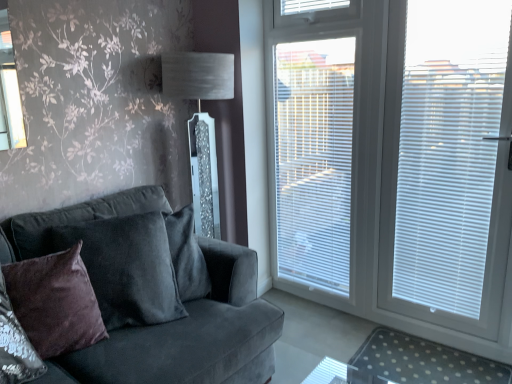
Question: Considering the relative sizes of white blinds at right and white plastic blinds at right, positioned as the third blind in left-to-right order, in the image provided, is white blinds at right bigger than white plastic blinds at right, positioned as the third blind in left-to-right order,?

Choices:
 (A) no
 (B) yes

Answer: (B)

Question: Does white blinds at right have a smaller size compared to white plastic blinds at right, positioned as the third blind in left-to-right order?

Choices:
 (A) yes
 (B) no

Answer: (B)

Question: From a real-world perspective, is white blinds at right physically above white plastic blinds at right, positioned as the third blind in left-to-right order?

Choices:
 (A) no
 (B) yes

Answer: (A)

Question: From the image's perspective, is white blinds at right over white plastic blinds at right, positioned as the third blind in left-to-right order?

Choices:
 (A) no
 (B) yes

Answer: (B)

Question: Can you confirm if white blinds at right is positioned to the left of white plastic blinds at right, positioned as the 1th blind in right-to-left order?

Choices:
 (A) yes
 (B) no

Answer: (A)

Question: From a real-world perspective, is white blinds at right beneath white plastic blinds at right, positioned as the third blind in left-to-right order?

Choices:
 (A) yes
 (B) no

Answer: (A)

Question: Is white blinds at right positioned in front of clear polka dot mat at lower right?

Choices:
 (A) no
 (B) yes

Answer: (B)

Question: Would you consider white blinds at right to be distant from clear polka dot mat at lower right?

Choices:
 (A) yes
 (B) no

Answer: (B)

Question: Does white blinds at right appear on the left side of clear polka dot mat at lower right?

Choices:
 (A) yes
 (B) no

Answer: (A)

Question: Is white blinds at right located outside clear polka dot mat at lower right?

Choices:
 (A) no
 (B) yes

Answer: (B)

Question: Considering the relative sizes of white blinds at right and clear polka dot mat at lower right in the image provided, is white blinds at right taller than clear polka dot mat at lower right?

Choices:
 (A) yes
 (B) no

Answer: (A)

Question: Is white blinds at right looking in the opposite direction of clear polka dot mat at lower right?

Choices:
 (A) no
 (B) yes

Answer: (A)

Question: Considering the relative sizes of clear polka dot mat at lower right and white plastic blinds at right, positioned as the 1th blind in right-to-left order, in the image provided, is clear polka dot mat at lower right wider than white plastic blinds at right, positioned as the 1th blind in right-to-left order,?

Choices:
 (A) yes
 (B) no

Answer: (A)